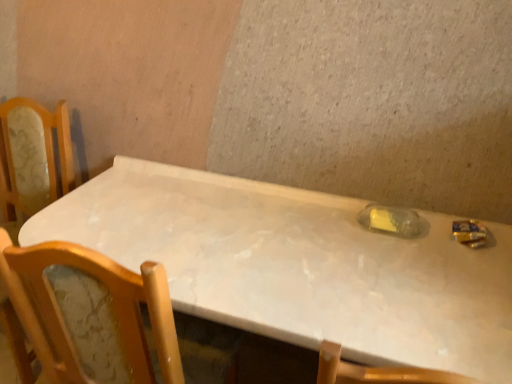
Find the location of `spots to the right of translucent plastic bottle at center`. spots to the right of translucent plastic bottle at center is located at coordinates (459, 242).